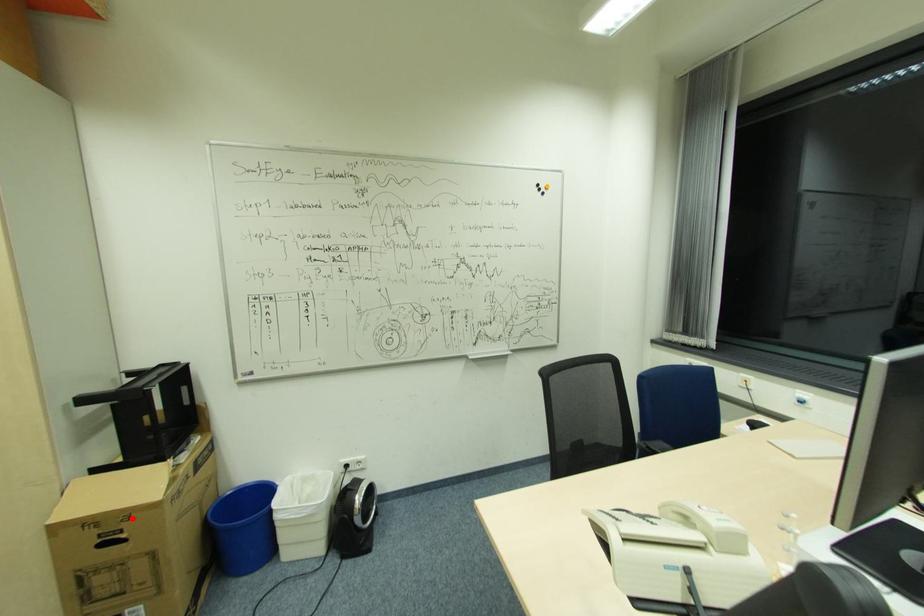
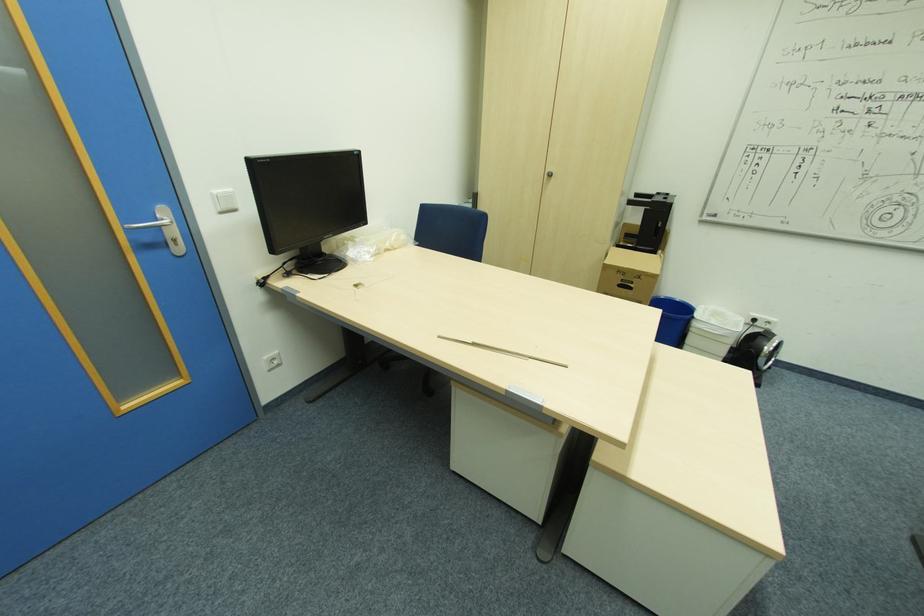
Where in the second image is the point corresponding to the highlighted location from the first image?

(641, 277)